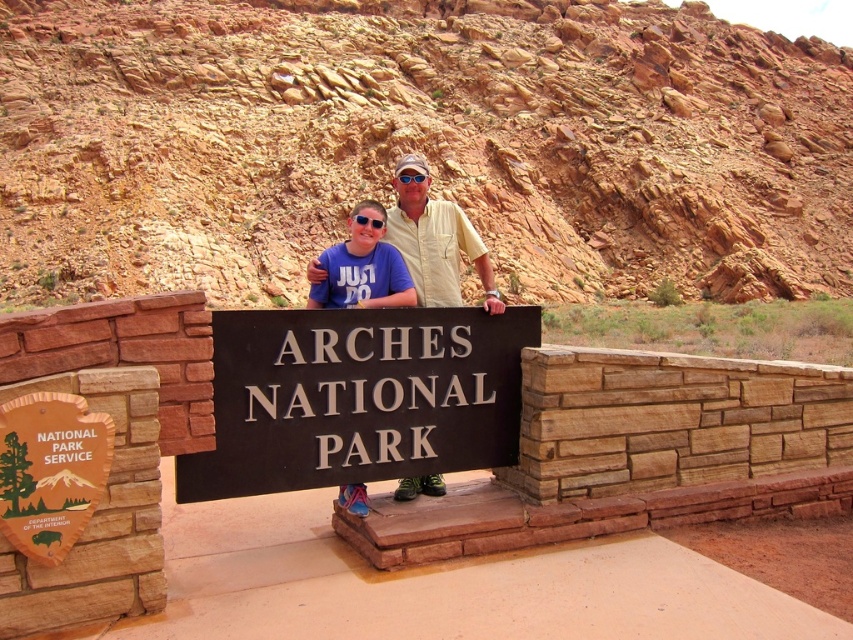
Question: Can you confirm if black metal sign at center is positioned to the left of blue fabric shirt at center?

Choices:
 (A) yes
 (B) no

Answer: (B)

Question: Is black metal sign at center behind matte yellow shirt at center?

Choices:
 (A) no
 (B) yes

Answer: (B)

Question: Does black metal sign at center come in front of matte yellow shirt at center?

Choices:
 (A) no
 (B) yes

Answer: (A)

Question: Which of the following is the closest to the observer?

Choices:
 (A) black metal sign at center
 (B) matte yellow shirt at center
 (C) blue fabric shirt at center

Answer: (C)

Question: Considering the real-world distances, which object is closest to the black metal sign at center?

Choices:
 (A) matte yellow shirt at center
 (B) blue fabric shirt at center

Answer: (B)

Question: Which point appears closest to the camera in this image?

Choices:
 (A) (366, 225)
 (B) (450, 401)
 (C) (363, 502)

Answer: (C)